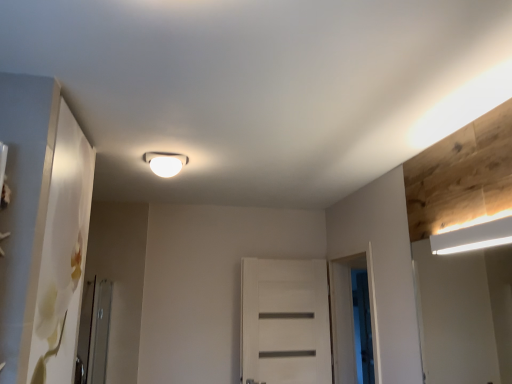
Question: Is transparent glass screen door at center-right, placed as the first screen door when sorted from right to left, bigger than white matte rectangular light fixture at upper right, the first lamp from the bottom?

Choices:
 (A) yes
 (B) no

Answer: (A)

Question: Considering the relative sizes of transparent glass screen door at center-right, positioned as the 1th screen door in back-to-front order, and white matte rectangular light fixture at upper right, marked as the second lamp in a top-to-bottom arrangement, in the image provided, is transparent glass screen door at center-right, positioned as the 1th screen door in back-to-front order, taller than white matte rectangular light fixture at upper right, marked as the second lamp in a top-to-bottom arrangement,?

Choices:
 (A) yes
 (B) no

Answer: (A)

Question: From a real-world perspective, is transparent glass screen door at center-right, the 3th screen door positioned from the front, located beneath white matte rectangular light fixture at upper right, the first lamp from the bottom?

Choices:
 (A) yes
 (B) no

Answer: (A)

Question: Is transparent glass screen door at center-right, positioned as the 1th screen door in back-to-front order, further to camera compared to white matte rectangular light fixture at upper right, which appears as the second lamp when viewed from the left?

Choices:
 (A) no
 (B) yes

Answer: (B)

Question: Can you confirm if transparent glass screen door at center-right, the third screen door viewed from the left, is smaller than white matte rectangular light fixture at upper right, marked as the second lamp in a top-to-bottom arrangement?

Choices:
 (A) yes
 (B) no

Answer: (B)

Question: Does transparent glass screen door at center-right, the 3th screen door positioned from the front, have a lesser height compared to white matte rectangular light fixture at upper right, the first lamp from the bottom?

Choices:
 (A) yes
 (B) no

Answer: (B)

Question: Does clear glass screen door at lower left, placed as the first screen door when sorted from left to right, have a greater height compared to white matte screen door at center, marked as the 2th screen door in a left-to-right arrangement?

Choices:
 (A) yes
 (B) no

Answer: (B)

Question: Is clear glass screen door at lower left, positioned as the third screen door in back-to-front order, positioned with its back to white matte screen door at center, positioned as the 2th screen door in right-to-left order?

Choices:
 (A) yes
 (B) no

Answer: (B)

Question: From a real-world perspective, is clear glass screen door at lower left, the first screen door positioned from the front, physically below white matte screen door at center, positioned as the 2th screen door in right-to-left order?

Choices:
 (A) no
 (B) yes

Answer: (B)

Question: From a real-world perspective, is clear glass screen door at lower left, placed as the first screen door when sorted from left to right, located higher than white matte screen door at center, marked as the 2th screen door in a left-to-right arrangement?

Choices:
 (A) no
 (B) yes

Answer: (A)

Question: Does clear glass screen door at lower left, placed as the first screen door when sorted from left to right, appear on the left side of white matte screen door at center, the second screen door in the front-to-back sequence?

Choices:
 (A) no
 (B) yes

Answer: (B)

Question: Is the position of clear glass screen door at lower left, positioned as the third screen door in back-to-front order, less distant than that of white matte screen door at center, marked as the 2th screen door in a left-to-right arrangement?

Choices:
 (A) no
 (B) yes

Answer: (B)

Question: Can you confirm if white matte rectangular light fixture at upper right, marked as the second lamp in a top-to-bottom arrangement, is smaller than white matte screen door at center, marked as the 2th screen door in a left-to-right arrangement?

Choices:
 (A) no
 (B) yes

Answer: (B)